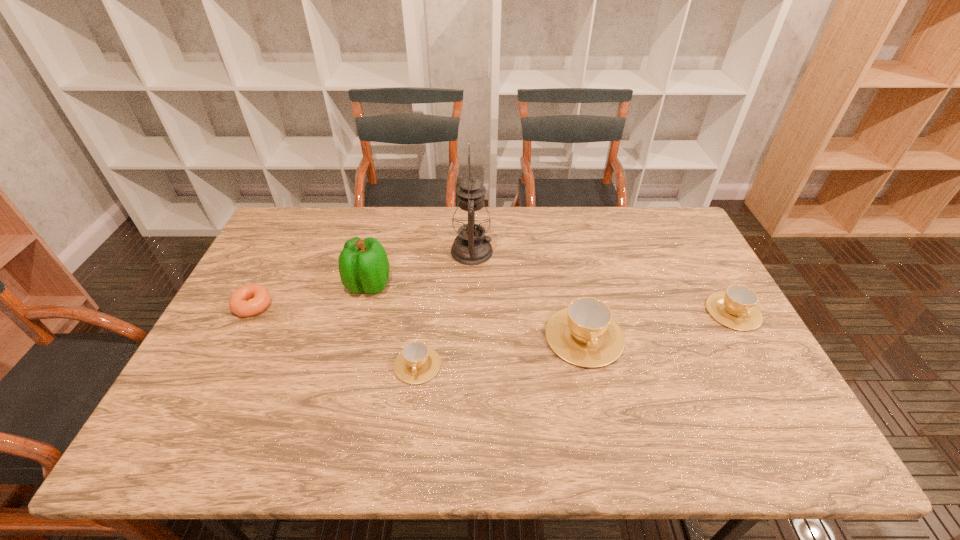
Where is `vacant place for an extra cup on the left`? The image size is (960, 540). vacant place for an extra cup on the left is located at coordinates (229, 396).